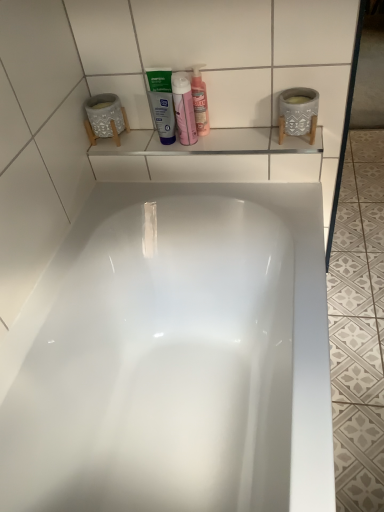
Find the location of `vacant region to the right of translucent plastic bottle at upper center`. vacant region to the right of translucent plastic bottle at upper center is located at coordinates (231, 138).